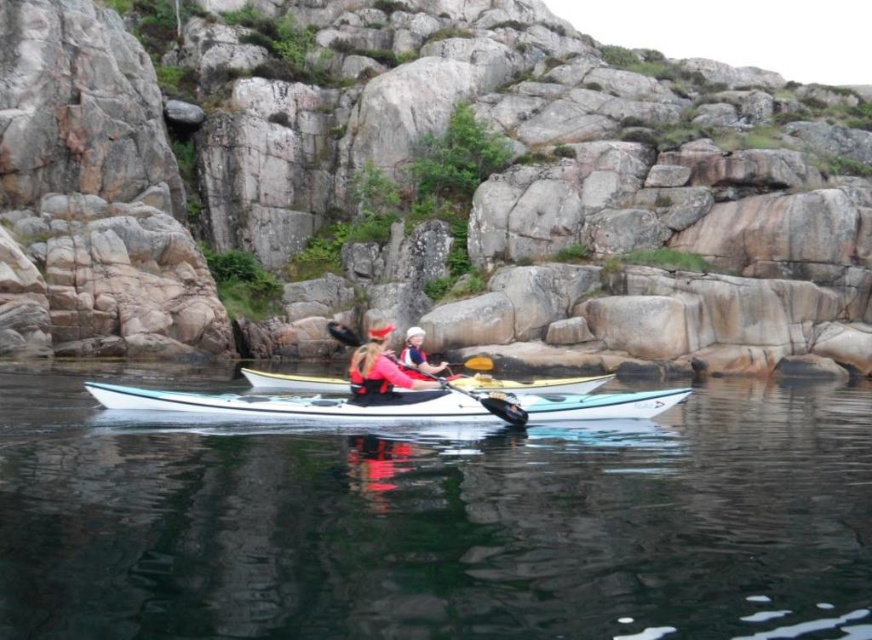
You are a photographer trying to capture the kayakers in the image. You want to ensure that both the clear water at center and the red fabric life vest at center are visible in your shot. Based on their positions, which object should you focus on first to frame the scene properly?

The clear water at center is positioned on the right side of the red fabric life vest at center. To frame the scene properly, you should focus on the red fabric life vest at center first, as it is on the left side, ensuring both objects are within the frame.

Looking at this image, you are a photographer trying to capture the gray stone rock formation at center and the matte pink life jacket at center in the same frame. Which object should you focus on first to ensure both are in focus?

You should focus on the gray stone rock formation at center first because it is closer to the viewer than the matte pink life jacket at center, so focusing on the closer object will help ensure both are in focus.